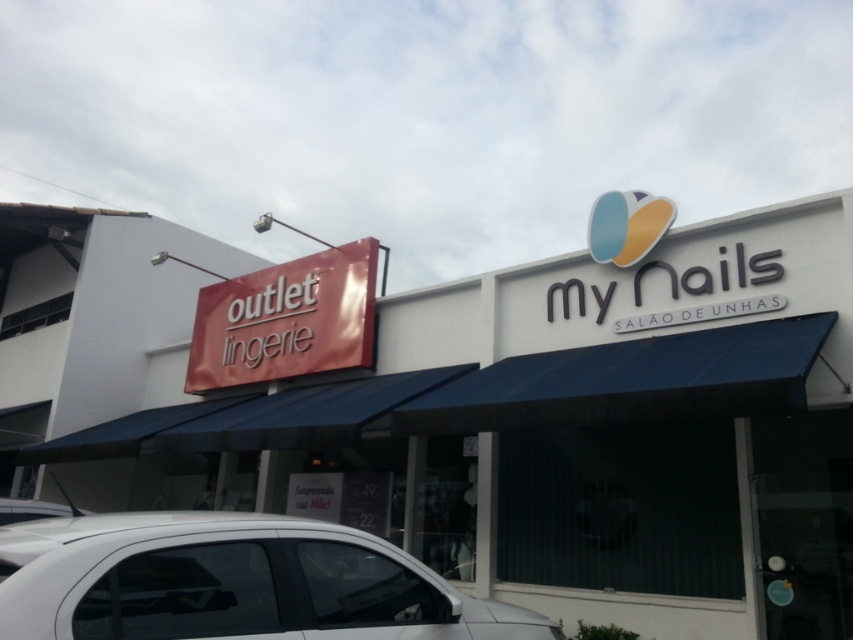
Is the position of matte red sign at upper left more distant than that of white glossy car at lower left?

Yes, it is.

Which is below, matte red sign at upper left or white glossy car at lower left?

Positioned lower is white glossy car at lower left.

The height and width of the screenshot is (640, 853). I want to click on matte red sign at upper left, so click(286, 320).

Locate an element on the screen. matte red sign at upper left is located at coordinates (286, 320).

Measure the distance between point (276, 534) and camera.

2.52 meters

Is point (35, 528) in front of point (74, 506)?

Yes, it is in front of point (74, 506).

Who is more distant from viewer, (x=352, y=600) or (x=15, y=499)?

The point (x=15, y=499) is more distant.

At what (x,y) coordinates should I click in order to perform the action: click on white matte car at lower left. Please return your answer as a coordinate pair (x, y). This screenshot has width=853, height=640. Looking at the image, I should click on (231, 582).

Between white matte car at lower left and matte red sign at upper left, which one appears on the left side from the viewer's perspective?

matte red sign at upper left is more to the left.

Which is in front, point (68, 577) or point (247, 352)?

Point (68, 577) is more forward.

Identify the location of white matte car at lower left. This screenshot has width=853, height=640. (231, 582).